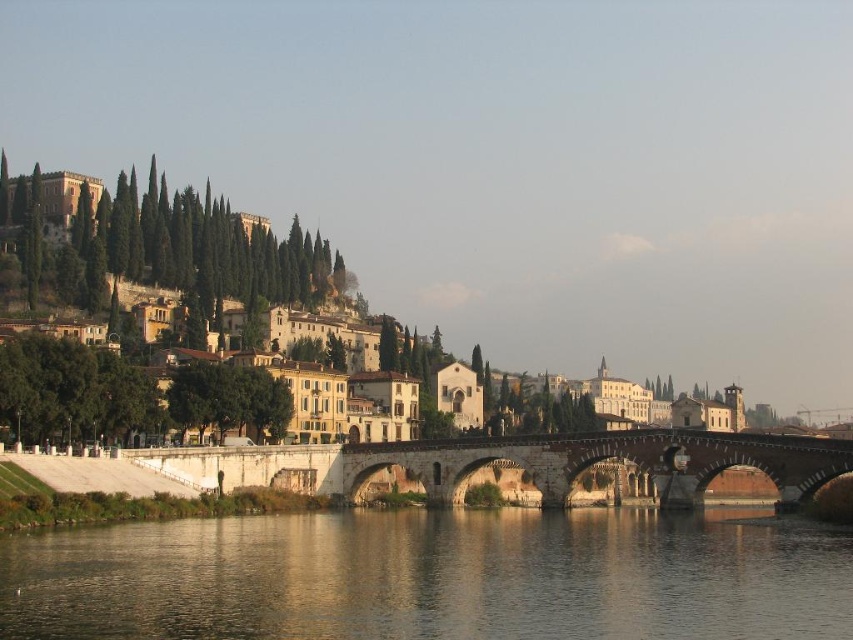
Based on the photo, can you confirm if transparent water at center is positioned to the right of stone bridge at center?

No, transparent water at center is not to the right of stone bridge at center.

Is transparent water at center above stone bridge at center?

Yes, transparent water at center is above stone bridge at center.

Who is more forward, (606, 570) or (548, 502)?

Point (606, 570) is in front.

The height and width of the screenshot is (640, 853). I want to click on transparent water at center, so click(431, 577).

Which of these two, transparent water at center or yellow stone buildings at center, stands shorter?

With less height is transparent water at center.

Does transparent water at center have a smaller size compared to yellow stone buildings at center?

Yes, transparent water at center is smaller than yellow stone buildings at center.

Does point (251, 560) come closer to viewer compared to point (189, 202)?

Yes.

Find the location of `transparent water at center`. transparent water at center is located at coordinates (431, 577).

Is yellow stone buildings at center smaller than stone bridge at center?

Incorrect, yellow stone buildings at center is not smaller in size than stone bridge at center.

Is yellow stone buildings at center further to camera compared to stone bridge at center?

Yes, yellow stone buildings at center is further from the viewer.

Who is more forward, (242, 224) or (252, 474)?

Positioned in front is point (252, 474).

The height and width of the screenshot is (640, 853). I want to click on yellow stone buildings at center, so click(163, 248).